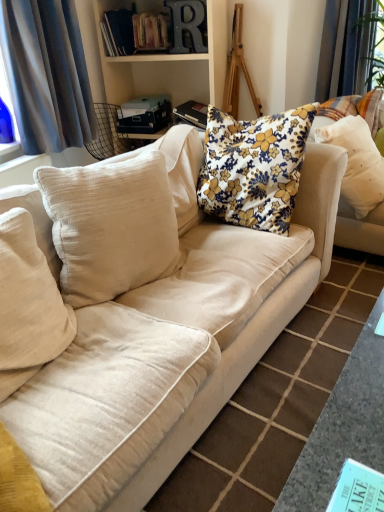
Question: From the image's perspective, is hardcover books at upper center, positioned as the 2th book in left-to-right order, above black hardcover book at upper center, positioned as the fourth book in right-to-left order?

Choices:
 (A) no
 (B) yes

Answer: (B)

Question: From a real-world perspective, is hardcover books at upper center, positioned as the 4th book in bottom-to-top order, physically below black hardcover book at upper center, the first book when ordered from left to right?

Choices:
 (A) yes
 (B) no

Answer: (B)

Question: Is hardcover books at upper center, placed as the first book when sorted from top to bottom, smaller than black hardcover book at upper center, which ranks as the third book in bottom-to-top order?

Choices:
 (A) yes
 (B) no

Answer: (B)

Question: Does hardcover books at upper center, which is the second book in front-to-back order, turn towards black hardcover book at upper center, the first book when ordered from left to right?

Choices:
 (A) yes
 (B) no

Answer: (B)

Question: Is hardcover books at upper center, which is counted as the 3th book, starting from the back, positioned with its back to black hardcover book at upper center, positioned as the fourth book in right-to-left order?

Choices:
 (A) no
 (B) yes

Answer: (A)

Question: From a real-world perspective, is floral fabric book at upper center, the 3th book positioned from the left, above or below gray fabric curtain at left?

Choices:
 (A) above
 (B) below

Answer: (B)

Question: From their relative heights in the image, would you say floral fabric book at upper center, which appears as the 2th book when viewed from the right, is taller or shorter than gray fabric curtain at left?

Choices:
 (A) tall
 (B) short

Answer: (B)

Question: In the image, is floral fabric book at upper center, which appears as the 2th book when viewed from the right, positioned in front of or behind gray fabric curtain at left?

Choices:
 (A) behind
 (B) front

Answer: (A)

Question: From the image's perspective, is floral fabric book at upper center, arranged as the second book when ordered from the bottom, positioned above or below gray fabric curtain at left?

Choices:
 (A) above
 (B) below

Answer: (B)

Question: Choose the correct answer: Is floral fabric cushion at center, the 2th pillow in the right-to-left sequence, inside teal paper book at lower right, marked as the first book in a front-to-back arrangement, or outside it?

Choices:
 (A) inside
 (B) outside

Answer: (B)

Question: From the image's perspective, is floral fabric cushion at center, the 2th pillow in the right-to-left sequence, located above or below teal paper book at lower right, the fourth book from the left?

Choices:
 (A) above
 (B) below

Answer: (A)

Question: From a real-world perspective, is floral fabric cushion at center, the third pillow in the left-to-right sequence, above or below teal paper book at lower right, arranged as the 1th book when viewed from the right?

Choices:
 (A) above
 (B) below

Answer: (A)

Question: Is floral fabric cushion at center, the third pillow in the left-to-right sequence, wider or thinner than teal paper book at lower right, acting as the fourth book starting from the top?

Choices:
 (A) wide
 (B) thin

Answer: (B)

Question: From a real-world perspective, is beige cotton pillow at left, arranged as the 1th pillow when viewed from the left, above or below floral fabric book at upper center, the 3th book in the top-to-bottom sequence?

Choices:
 (A) below
 (B) above

Answer: (A)

Question: Does point (18, 336) appear closer or farther from the camera than point (193, 112)?

Choices:
 (A) farther
 (B) closer

Answer: (B)